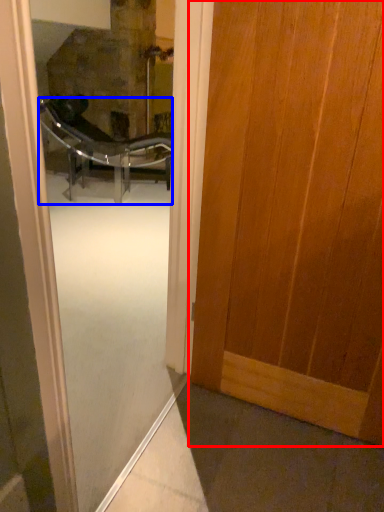
Question: Among these objects, which one is nearest to the camera, door (highlighted by a red box) or chair (highlighted by a blue box)?

Choices:
 (A) door
 (B) chair

Answer: (A)